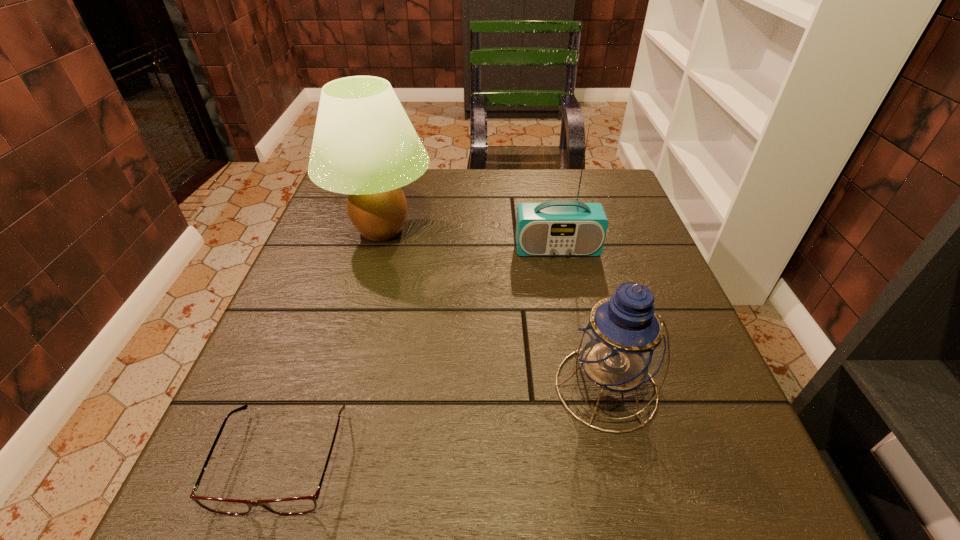
Locate an element on the screen. The width and height of the screenshot is (960, 540). object that is the second closest to the third shortest object is located at coordinates (620, 344).

Select which object is the second closest to the lampshade. Please provide its 2D coordinates. Your answer should be formatted as a tuple, i.e. [(x, y)], where the tuple contains the x and y coordinates of a point satisfying the conditions above.

[(620, 344)]

You are a GUI agent. You are given a task and a screenshot of the screen. Output one action in this format:
    pyautogui.click(x=<x>, y=<y>)
    Task: Click on the vacant space that satisfies the following two spatial constraints: 1. on the shade of the lampshade; 2. on the lenses of the spectacles
    
    Given the screenshot: What is the action you would take?
    pyautogui.click(x=318, y=458)

This screenshot has height=540, width=960. I want to click on vacant space that satisfies the following two spatial constraints: 1. on the shade of the lampshade; 2. on the lenses of the spectacles, so click(318, 458).